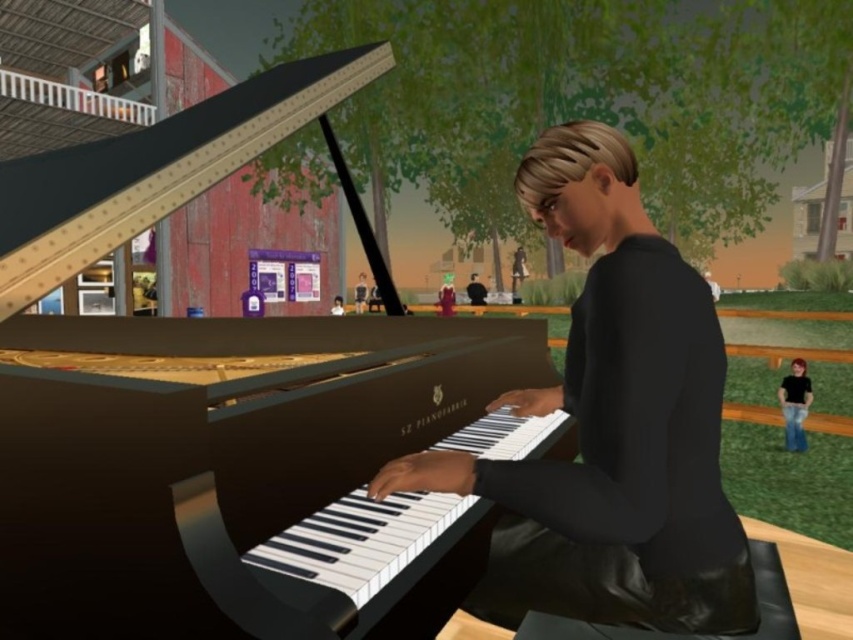
Who is taller, smooth black sweater at center or matte black shirt at center?

smooth black sweater at center is taller.

Which is behind, point (624, 257) or point (485, 294)?

The point (485, 294) is more distant.

Between point (622, 433) and point (474, 276), which one is positioned in front?

Positioned in front is point (622, 433).

The height and width of the screenshot is (640, 853). Identify the location of smooth black sweater at center. (610, 426).

The width and height of the screenshot is (853, 640). What do you see at coordinates (610, 426) in the screenshot?
I see `smooth black sweater at center` at bounding box center [610, 426].

Which of these two, smooth black sweater at center or black matte jeans at lower right, stands taller?

With more height is smooth black sweater at center.

Find the location of a particular element. This screenshot has width=853, height=640. smooth black sweater at center is located at coordinates (610, 426).

The width and height of the screenshot is (853, 640). What are the coordinates of `smooth black sweater at center` in the screenshot? It's located at (610, 426).

Does shiny polished wood piano at center have a greater height compared to smooth black sweater at center?

Yes.

Which is behind, point (361, 433) or point (422, 452)?

Positioned behind is point (361, 433).

Between point (73, 374) and point (529, 525), which one is positioned behind?

Point (529, 525)

This screenshot has width=853, height=640. I want to click on shiny polished wood piano at center, so click(227, 413).